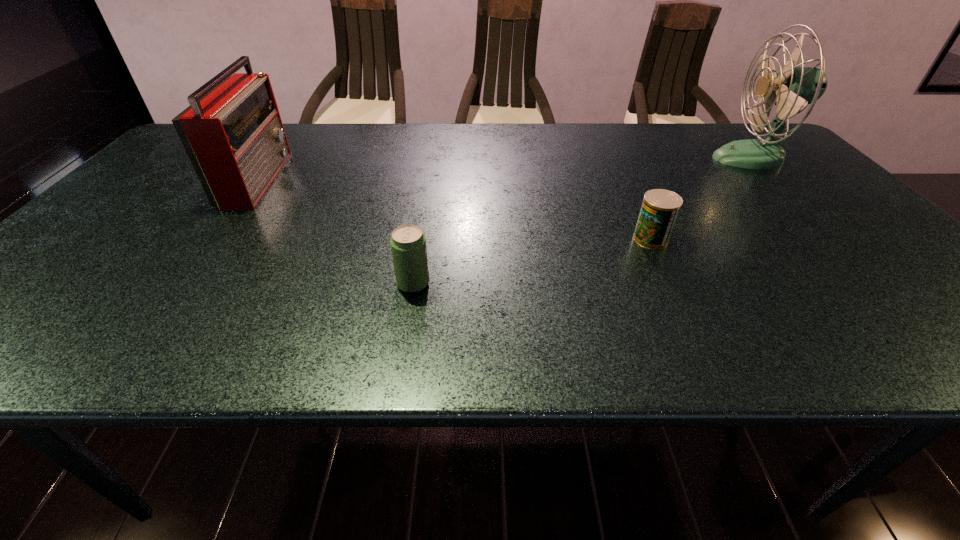
Where is `vacant area that satisfies the following two spatial constraints: 1. on the front-facing side of the third shortest object; 2. on the right side of the third object from left to right`? The image size is (960, 540). vacant area that satisfies the following two spatial constraints: 1. on the front-facing side of the third shortest object; 2. on the right side of the third object from left to right is located at coordinates [x=213, y=239].

Image resolution: width=960 pixels, height=540 pixels. I want to click on free space that satisfies the following two spatial constraints: 1. on the front-facing side of the can; 2. on the left side of the radio receiver, so click(213, 239).

You are a GUI agent. You are given a task and a screenshot of the screen. Output one action in this format:
    pyautogui.click(x=<x>, y=<y>)
    Task: Click on the vacant point that satisfies the following two spatial constraints: 1. on the front-facing side of the soda; 2. on the right side of the leftmost object
    The image size is (960, 540).
    Given the screenshot: What is the action you would take?
    pyautogui.click(x=180, y=284)